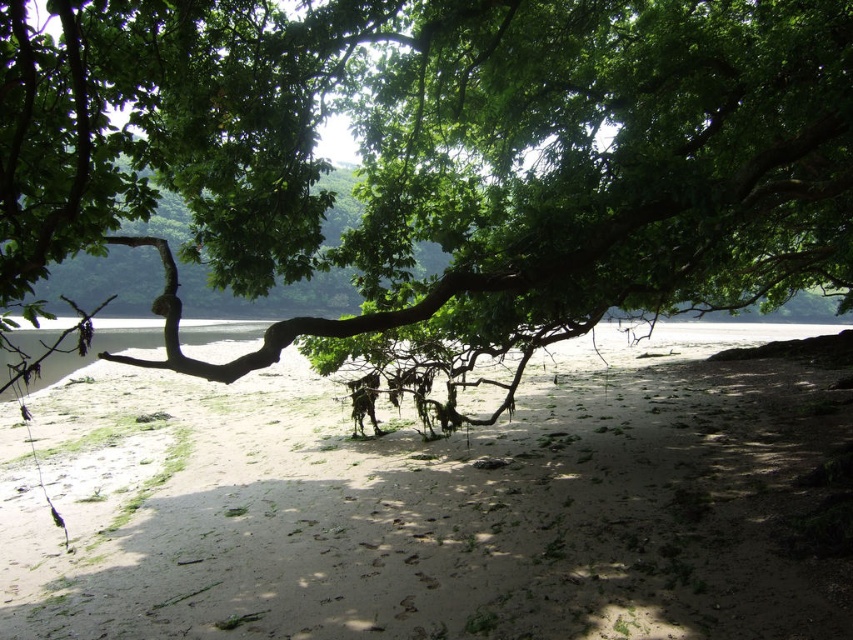
Question: Where is green leafy tree at center located in relation to white sandy beach at center in the image?

Choices:
 (A) above
 (B) below

Answer: (A)

Question: Which of the following is the farthest from the observer?

Choices:
 (A) white sandy beach at center
 (B) clear water at center
 (C) green leafy tree at center

Answer: (B)

Question: Which object appears farthest from the camera in this image?

Choices:
 (A) white sandy beach at center
 (B) green leafy tree at center

Answer: (A)

Question: Where is green leafy tree at center located in relation to white sandy beach at center in the image?

Choices:
 (A) below
 (B) above

Answer: (B)

Question: Which point is closer to the camera?

Choices:
 (A) (759, 609)
 (B) (558, 96)
 (C) (809, 332)

Answer: (A)

Question: Does white sandy beach at center appear over clear water at center?

Choices:
 (A) no
 (B) yes

Answer: (A)